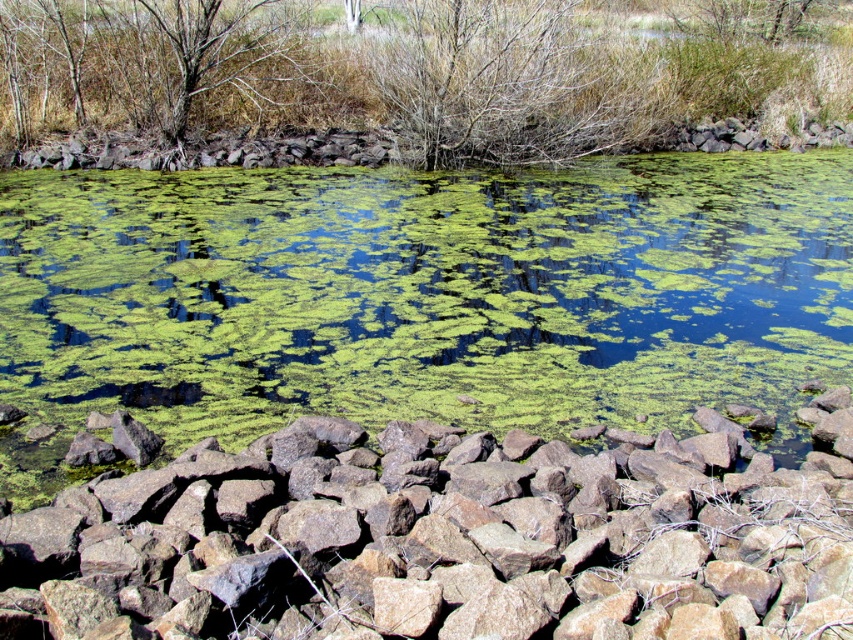
Question: Is brown rough rock at lower center wider than brown/dry wood tree at upper left?

Choices:
 (A) no
 (B) yes

Answer: (B)

Question: Does green algae at center have a smaller size compared to brown/dry wood tree at upper left?

Choices:
 (A) no
 (B) yes

Answer: (A)

Question: Which of the following is the farthest from the observer?

Choices:
 (A) (115, 80)
 (B) (416, 417)

Answer: (A)

Question: Which of these objects is positioned farthest from the brown/dry wood tree at upper left?

Choices:
 (A) green algae at center
 (B) brown rough rock at lower center

Answer: (B)

Question: Which object is positioned farthest from the brown/dry wood tree at upper left?

Choices:
 (A) green algae at center
 (B) brown rough rock at lower center

Answer: (B)

Question: Is the position of green algae at center less distant than that of brown rough rock at lower center?

Choices:
 (A) no
 (B) yes

Answer: (A)